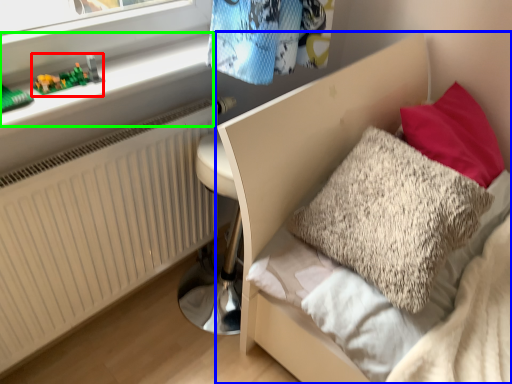
Question: Based on their relative distances, which object is nearer to toy (highlighted by a red box)? Choose from bed (highlighted by a blue box) and window sill (highlighted by a green box).

Choices:
 (A) bed
 (B) window sill

Answer: (B)